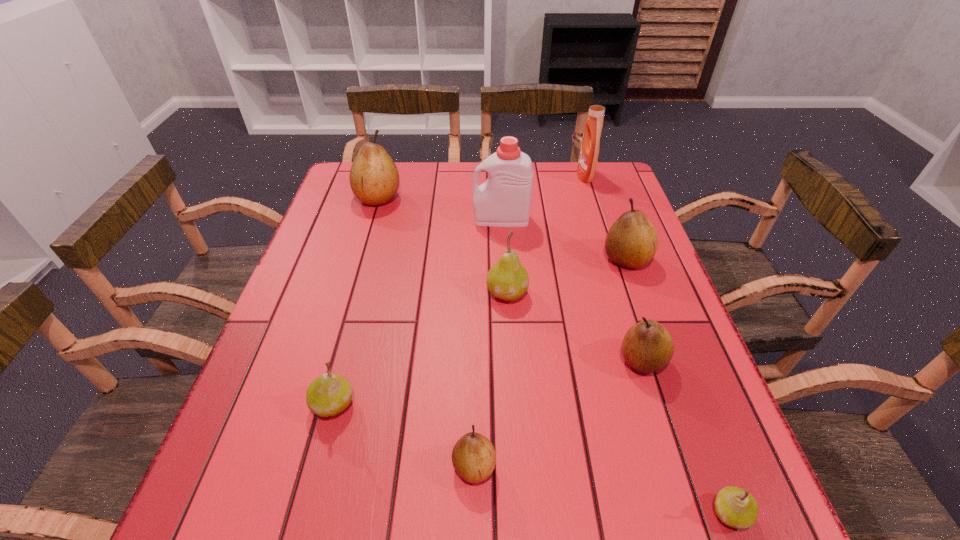
At what (x,y) coordinates should I click in order to perform the action: click on the third farthest brown pear. Please return your answer as a coordinate pair (x, y). This screenshot has height=540, width=960. Looking at the image, I should click on (647, 347).

This screenshot has width=960, height=540. Identify the location of the leftmost green pear. (328, 395).

This screenshot has height=540, width=960. I want to click on the second nearest green pear, so click(328, 395).

Find the location of a particular element. This screenshot has height=540, width=960. the second brown pear from left to right is located at coordinates (473, 456).

At what (x,y) coordinates should I click in order to perform the action: click on the eighth farthest object. Please return your answer as a coordinate pair (x, y). The height and width of the screenshot is (540, 960). Looking at the image, I should click on (473, 456).

Find the location of a particular element. the rightmost green pear is located at coordinates [736, 507].

This screenshot has height=540, width=960. I want to click on the nearest object, so click(x=736, y=507).

You are a GUI agent. You are given a task and a screenshot of the screen. Output one action in this format:
    pyautogui.click(x=<x>, y=<y>)
    Task: Click on the blank space located on the front-facing side of the farther detergent
    
    Given the screenshot: What is the action you would take?
    (x=524, y=176)

Where is `vacant position located on the front-facing side of the farther detergent`? This screenshot has width=960, height=540. vacant position located on the front-facing side of the farther detergent is located at coordinates (x=562, y=176).

Locate an element on the screen. The image size is (960, 540). free spot located on the front-facing side of the farther detergent is located at coordinates (556, 176).